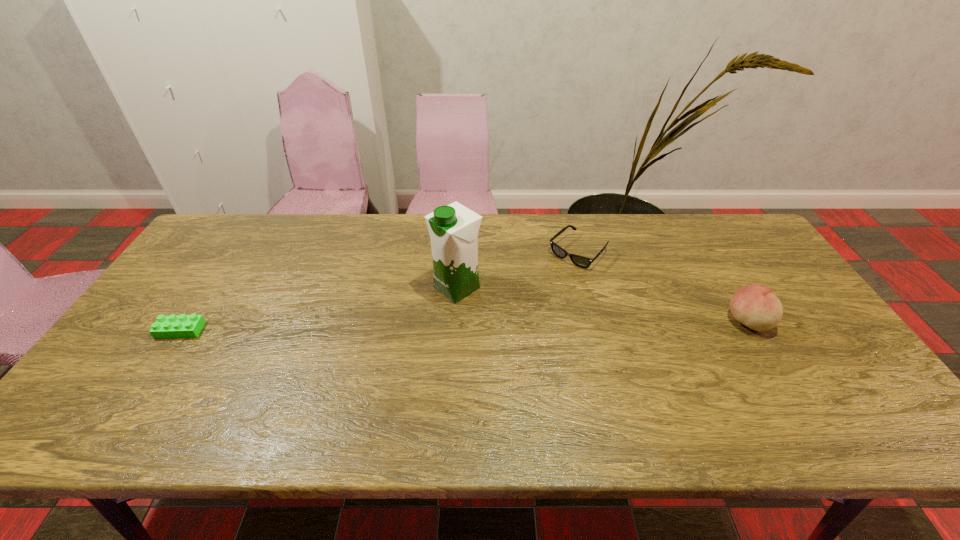
Where is `vacant point located between the shortest object and the second shortest object`? The width and height of the screenshot is (960, 540). vacant point located between the shortest object and the second shortest object is located at coordinates (379, 291).

Where is `unoccupied position between the leftmost object and the rightmost object`? The width and height of the screenshot is (960, 540). unoccupied position between the leftmost object and the rightmost object is located at coordinates (464, 326).

Locate an element on the screen. free space between the tallest object and the rightmost object is located at coordinates (602, 305).

Find the location of `blank region between the sunglasses and the peach`. blank region between the sunglasses and the peach is located at coordinates (662, 287).

Identify which object is the third closest to the peach. Please provide its 2D coordinates. Your answer should be formatted as a tuple, i.e. [(x, y)], where the tuple contains the x and y coordinates of a point satisfying the conditions above.

[(173, 326)]

I want to click on the closest object to the third shortest object, so click(580, 261).

Find the location of a particular element. free location that satisfies the following two spatial constraints: 1. on the back side of the soya milk; 2. on the right side of the sunglasses is located at coordinates (459, 252).

The image size is (960, 540). Identify the location of blank space that satisfies the following two spatial constraints: 1. on the front side of the second object from right to left; 2. on the right side of the peach. (596, 321).

Locate an element on the screen. This screenshot has width=960, height=540. free spot that satisfies the following two spatial constraints: 1. on the back side of the tallest object; 2. on the left side of the Lego is located at coordinates (209, 287).